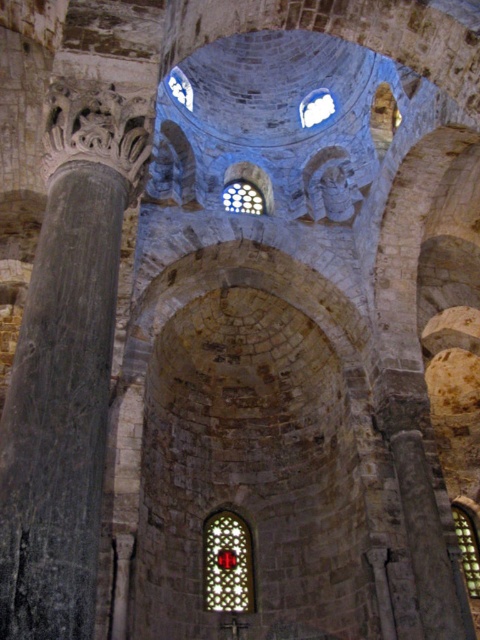
Question: Which point appears farthest from the camera in this image?

Choices:
 (A) (233, 193)
 (B) (331, 115)

Answer: (B)

Question: From the image, what is the correct spatial relationship of clear glass window at lower right in relation to clear glass window at upper center?

Choices:
 (A) right
 (B) left

Answer: (A)

Question: Which point is closer to the camera?

Choices:
 (A) clear glass window at lower right
 (B) black stone column at left
 (C) transparent glass window at upper center
 (D) clear glass window at upper center

Answer: (B)

Question: Is clear glass window at center bigger than clear glass window at upper center?

Choices:
 (A) yes
 (B) no

Answer: (A)

Question: Is clear glass window at center positioned before transparent glass window at upper center?

Choices:
 (A) yes
 (B) no

Answer: (B)

Question: Estimate the real-world distances between objects in this image. Which object is closer to the transparent glass window at upper center?

Choices:
 (A) clear glass window at upper center
 (B) clear glass window at center
 (C) stained glass window at center
 (D) clear glass window at lower right

Answer: (B)